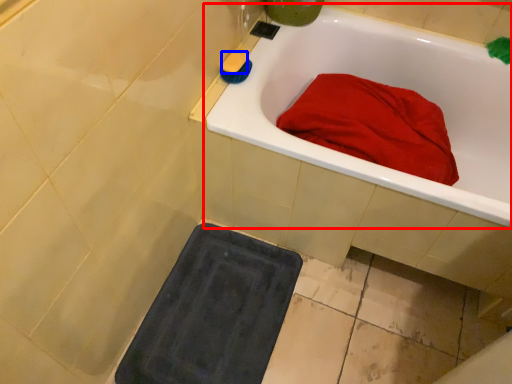
Question: Among these objects, which one is nearest to the camera, bathtub (highlighted by a red box) or soap (highlighted by a blue box)?

Choices:
 (A) bathtub
 (B) soap

Answer: (A)